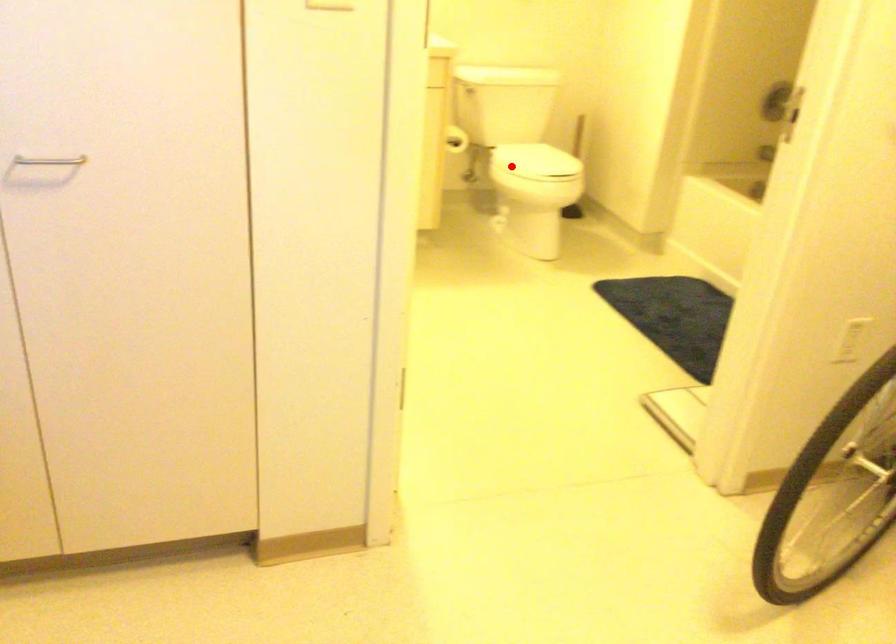
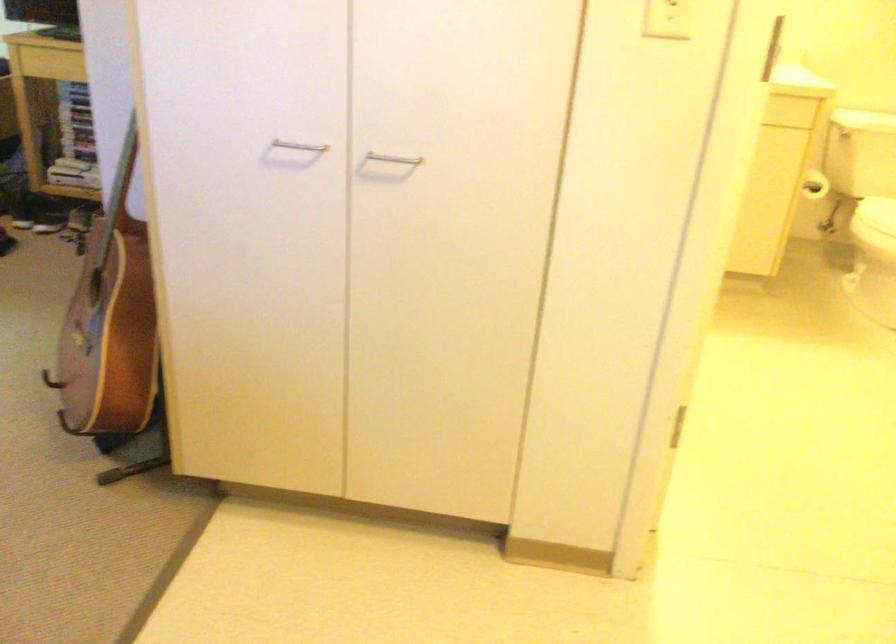
Question: A red point is marked in image1. In image2, is the corresponding 3D point closer to the camera or farther? Reply with the corresponding letter.

Choices:
 (A) The corresponding 3D point is closer.
 (B) The corresponding 3D point is farther.

Answer: (A)